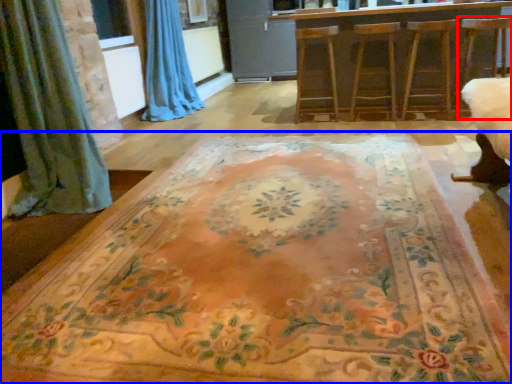
Question: Which object is further to the camera taking this photo, swivel chair (highlighted by a red box) or furniture (highlighted by a blue box)?

Choices:
 (A) swivel chair
 (B) furniture

Answer: (A)